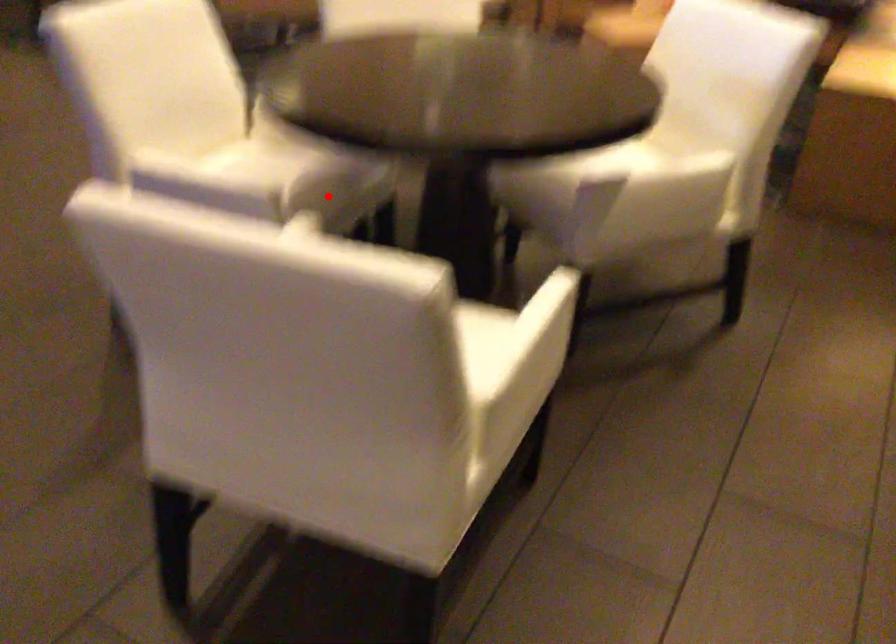
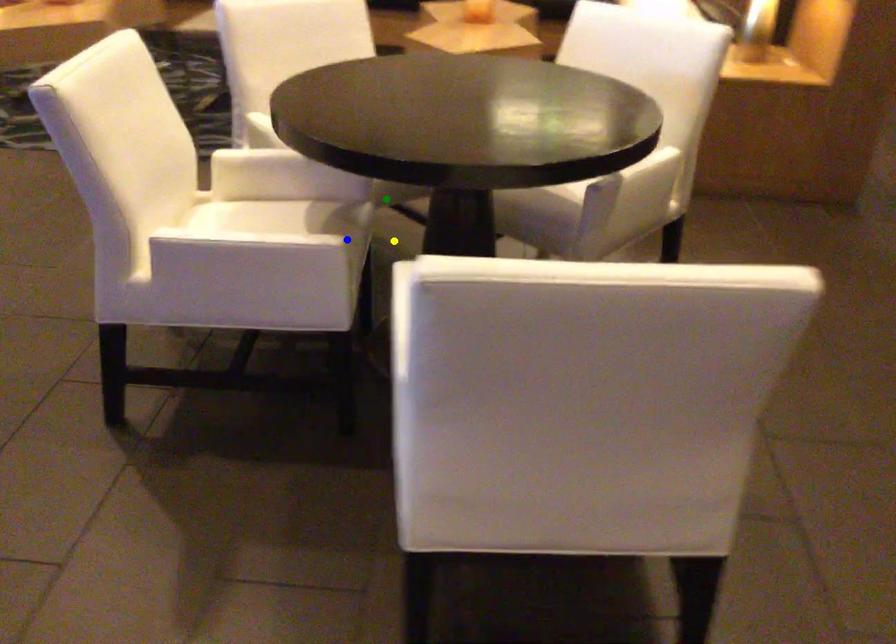
Question: I am providing you with two images of the same scene from different viewpoints. A red point is marked on the first image. You are given multiple points on the second image. Which mark in image 2 goes with the point in image 1?

Choices:
 (A) blue point
 (B) yellow point
 (C) green point

Answer: (A)